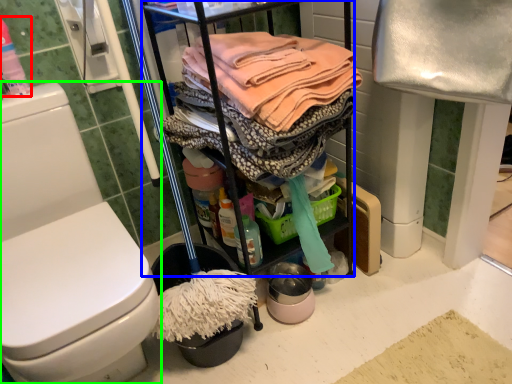
Question: Which is nearer to the cleaning products (highlighted by a red box)? cabinetry (highlighted by a blue box) or toilet (highlighted by a green box).

Choices:
 (A) cabinetry
 (B) toilet

Answer: (B)